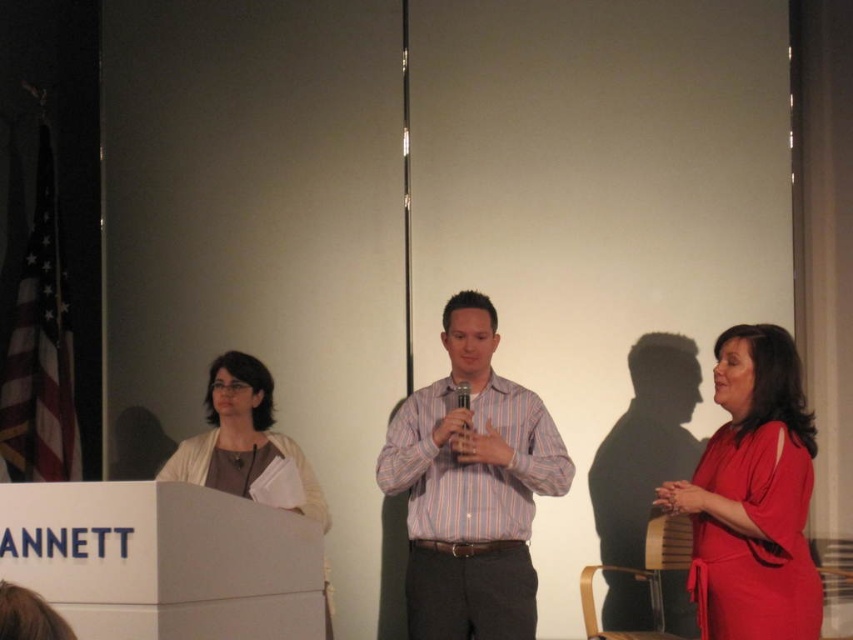
You are a photographer at a formal event. You need to capture a photo of both the striped cotton shirt at center and the matte red dress at right in the same frame. The camera you are using has a minimum focus distance of 60 centimeters. Will both subjects be in focus if they remain at their current positions?

The striped cotton shirt at center and the matte red dress at right are 65.18 centimeters apart from each other. Since the camera requires a minimum focus distance of 60 centimeters, the 65.18 centimeters between them exceeds this requirement. Therefore, both subjects will be in focus if they stay in their current positions.

You are standing in the front row of the audience facing the stage. You notice the striped cotton shirt at center. Where is the striped cotton shirt at center located relative to the point marked at coordinates (x=471, y=486)?

The striped cotton shirt at center is located exactly at the point marked at coordinates (x=471, y=486).